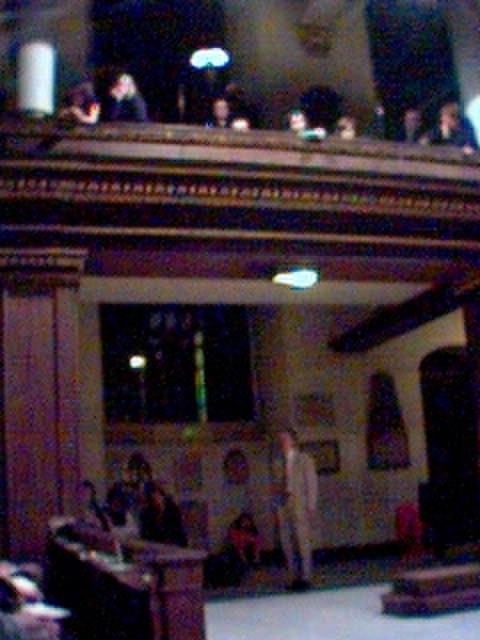
Question: Does light beige pants at center appear on the right side of matte black suit at upper center?

Choices:
 (A) no
 (B) yes

Answer: (B)

Question: Does light beige pants at center have a smaller size compared to matte black suit at upper center?

Choices:
 (A) yes
 (B) no

Answer: (B)

Question: Which object is closer to the camera taking this photo?

Choices:
 (A) light beige pants at center
 (B) matte black suit at upper center

Answer: (B)

Question: From the image, what is the correct spatial relationship of light beige pants at center in relation to matte black suit at upper center?

Choices:
 (A) above
 (B) below

Answer: (B)

Question: Which point is farther to the camera?

Choices:
 (A) matte black suit at upper center
 (B) light beige pants at center

Answer: (B)